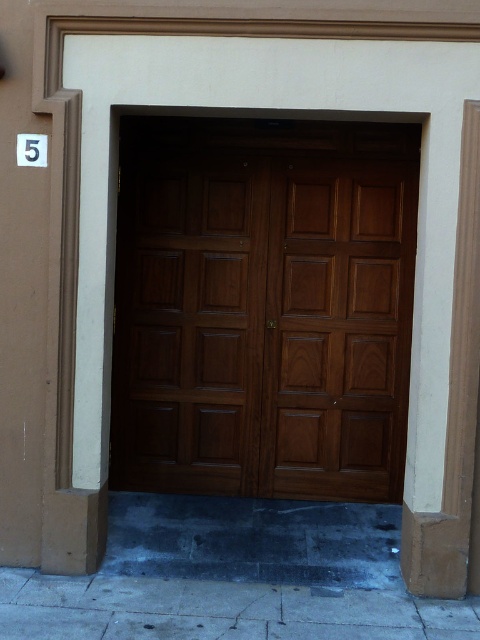
Which is more to the left, dark gray concrete pavement at lower center or smooth beige pillar at right?

dark gray concrete pavement at lower center is more to the left.

Who is more distant from viewer, (412, 618) or (442, 493)?

Point (442, 493)

Is point (197, 524) less distant than point (469, 458)?

No, it is not.

At what (x,y) coordinates should I click in order to perform the action: click on dark gray concrete pavement at lower center. Please return your answer as a coordinate pair (x, y). This screenshot has width=480, height=640. Looking at the image, I should click on (235, 577).

Does wooden door at center have a larger size compared to gray concrete pavement at lower center?

Yes, wooden door at center is bigger than gray concrete pavement at lower center.

Between point (214, 476) and point (76, 611), which one is positioned behind?

The point (214, 476) is behind.

Which is in front, point (214, 189) or point (343, 596)?

Point (343, 596)

Locate an element on the screen. wooden door at center is located at coordinates (189, 317).

Does point (256, 397) come closer to viewer compared to point (38, 582)?

No, (256, 397) is further to viewer.

This screenshot has width=480, height=640. I want to click on wooden door at center, so click(189, 317).